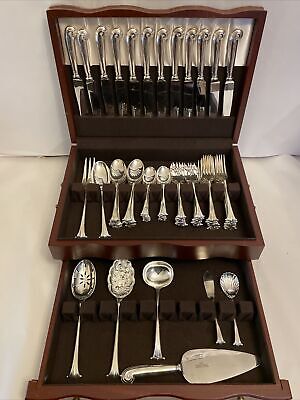
Where is `spoons`? This screenshot has width=300, height=400. spoons is located at coordinates (101, 176), (117, 177), (134, 170), (151, 174), (164, 177), (87, 281), (125, 280), (158, 278), (229, 282).